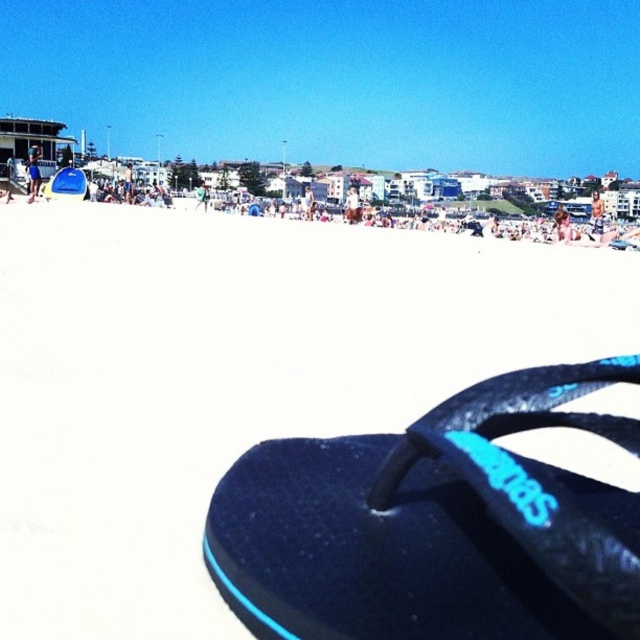
Question: Among these points, which one is nearest to the camera?

Choices:
 (A) click(x=256, y=214)
 (B) click(x=500, y=468)

Answer: (B)

Question: Does white sand at lower center have a greater width compared to black rubber sandal at lower right?

Choices:
 (A) no
 (B) yes

Answer: (A)

Question: Which of the following is the closest to the observer?

Choices:
 (A) (250, 216)
 (B) (67, 413)
 (C) (512, 500)

Answer: (C)

Question: Among these objects, which one is farthest from the camera?

Choices:
 (A) black rubber sandal at lower right
 (B) white sand at center

Answer: (B)

Question: Can you confirm if black rubber sandal at lower right is positioned to the left of white sand at center?

Choices:
 (A) yes
 (B) no

Answer: (A)

Question: Does white sand at lower center appear over white sand at center?

Choices:
 (A) yes
 (B) no

Answer: (B)